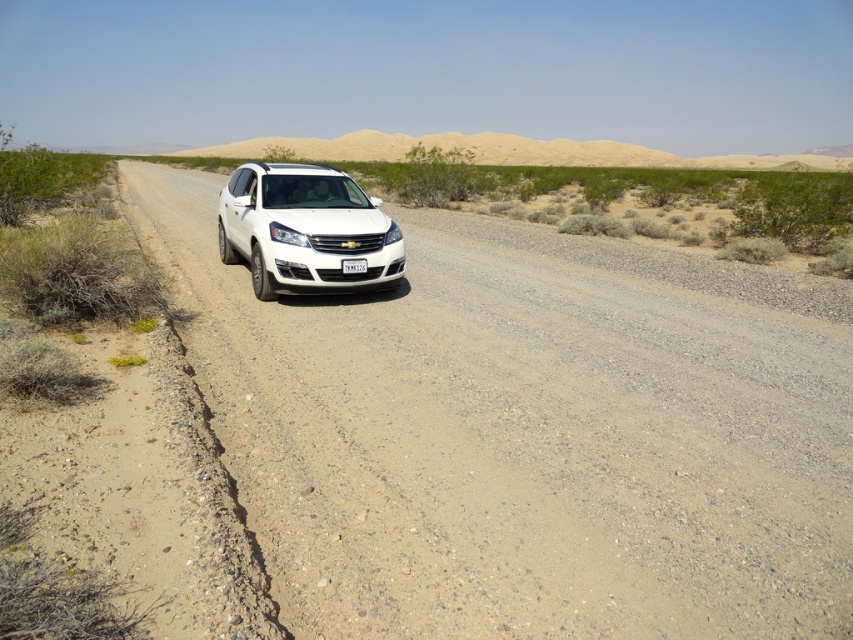
Question: Can you confirm if white gravel road at center is bigger than white glossy suv at center?

Choices:
 (A) yes
 (B) no

Answer: (A)

Question: Is white gravel road at center smaller than white glossy suv at center?

Choices:
 (A) yes
 (B) no

Answer: (B)

Question: Which of the following is the closest to the observer?

Choices:
 (A) (268, 170)
 (B) (357, 268)
 (C) (694, 609)

Answer: (C)

Question: Does white gravel road at center lie in front of white glossy suv at center?

Choices:
 (A) no
 (B) yes

Answer: (B)

Question: Which object appears closest to the camera in this image?

Choices:
 (A) white gravel road at center
 (B) white glossy suv at center
 (C) white plastic license plate at center

Answer: (A)

Question: Which of these objects is positioned farthest from the white gravel road at center?

Choices:
 (A) white glossy suv at center
 (B) white plastic license plate at center

Answer: (A)